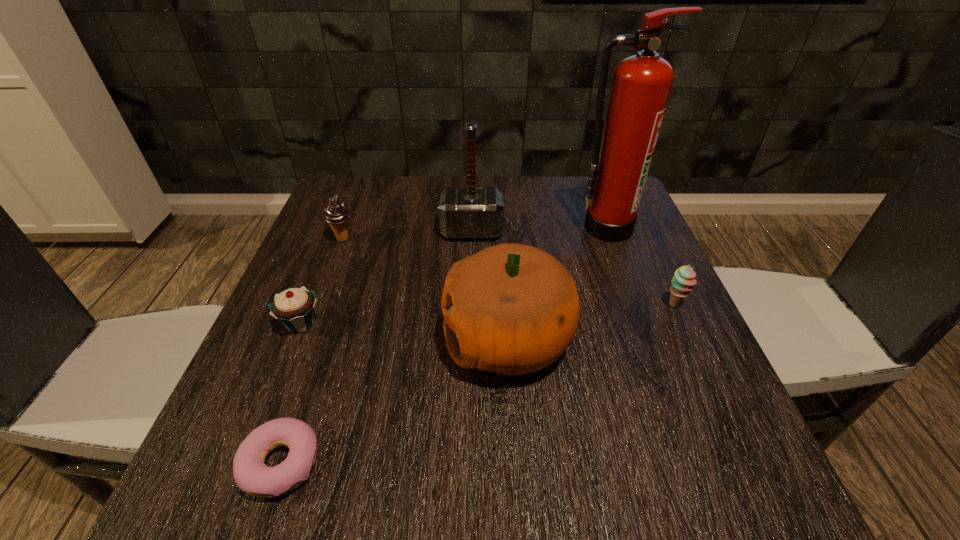
You are a GUI agent. You are given a task and a screenshot of the screen. Output one action in this format:
    pyautogui.click(x=<x>, y=<y>)
    Task: Click on the blank space at the right edge of the desktop
    The image size is (960, 540).
    Given the screenshot: What is the action you would take?
    pyautogui.click(x=604, y=277)

Locate an element on the screen. This screenshot has height=540, width=960. vacant space at the near left corner is located at coordinates click(194, 496).

Identify the location of empty space between the nearest object and the icecream. [x=312, y=351].

The height and width of the screenshot is (540, 960). In order to click on empty location between the second tallest object and the icecream in this screenshot , I will do `click(407, 235)`.

The image size is (960, 540). In order to click on unoccupied position between the hammer and the sherbert in this screenshot , I will do `click(573, 268)`.

This screenshot has height=540, width=960. Identify the location of free space between the pumpkin and the shortest object. (395, 402).

Locate an element on the screen. This screenshot has width=960, height=540. free space between the shortest object and the sherbert is located at coordinates (478, 384).

The width and height of the screenshot is (960, 540). I want to click on free point between the doughnut and the icecream, so click(312, 351).

The width and height of the screenshot is (960, 540). I want to click on vacant area that lies between the pumpkin and the cupcake, so click(404, 332).

Identify which object is the fifth closest to the doughnut. Please provide its 2D coordinates. Your answer should be formatted as a tuple, i.e. [(x, y)], where the tuple contains the x and y coordinates of a point satisfying the conditions above.

[(683, 280)]